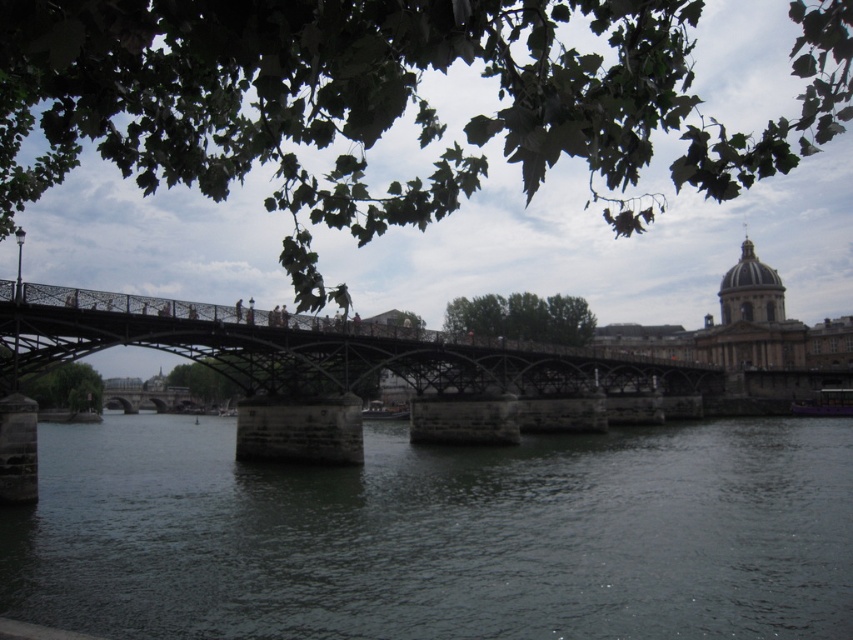
Which is more to the right, dark gray water at center or green wrought iron bridge at center?

Positioned to the right is green wrought iron bridge at center.

This screenshot has height=640, width=853. In order to click on dark gray water at center in this screenshot , I will do `click(438, 534)`.